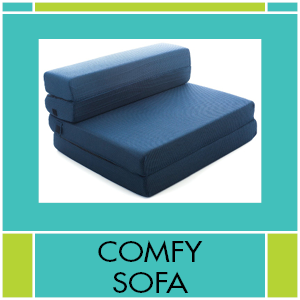
This screenshot has height=300, width=300. I want to click on sofa, so click(206, 143).